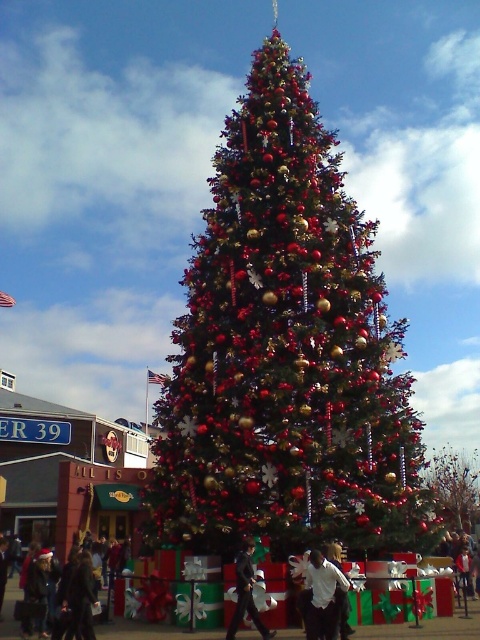
Question: Which object is closer to the camera taking this photo?

Choices:
 (A) black suit at center
 (B) white cotton shirt at center

Answer: (A)

Question: Is shiny metallic christmas tree at center wider than white cotton shirt at center?

Choices:
 (A) no
 (B) yes

Answer: (B)

Question: Does shiny metallic christmas tree at center come behind white cotton shirt at center?

Choices:
 (A) no
 (B) yes

Answer: (A)

Question: Which object is positioned farthest from the white matte shirt at center?

Choices:
 (A) black suit at center
 (B) shiny metallic christmas tree at center
 (C) shiny red ornaments at center

Answer: (C)

Question: Is shiny red ornaments at center bigger than white cotton shirt at center?

Choices:
 (A) yes
 (B) no

Answer: (A)

Question: Which of the following is the farthest from the observer?

Choices:
 (A) (462, 547)
 (B) (244, 573)

Answer: (A)